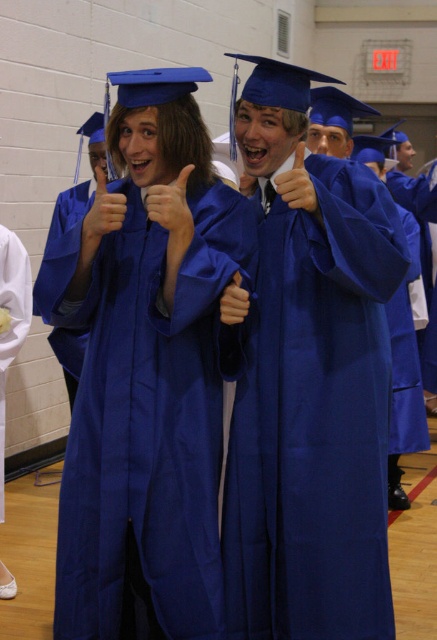
You are standing in the graduation ceremony venue and want to take a photo of the blue satin gown at center. Where should you aim your camera to capture it?

You should aim your camera at point (x=146, y=416) to capture the blue satin gown at center.

You are a photographer at the graduation ceremony. You need to capture a photo that includes both the matte blue gown at center and the blue satin gown at left. Based on their positions, which gown should you position closer to the left side of the frame to include both in the photo?

The blue satin gown at left is already positioned to the left of the matte blue gown at center, so to include both in the photo, you should position the blue satin gown at left closer to the left side of the frame.